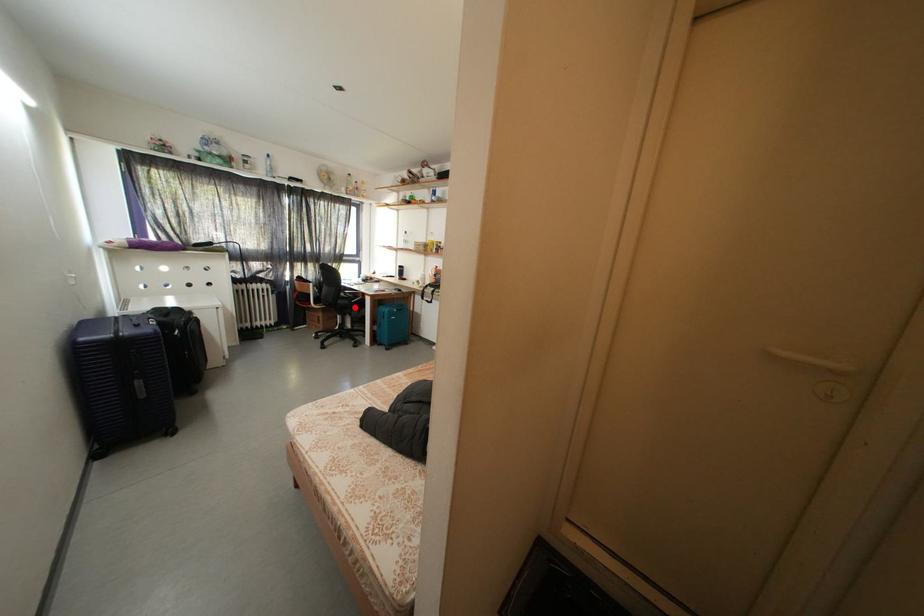
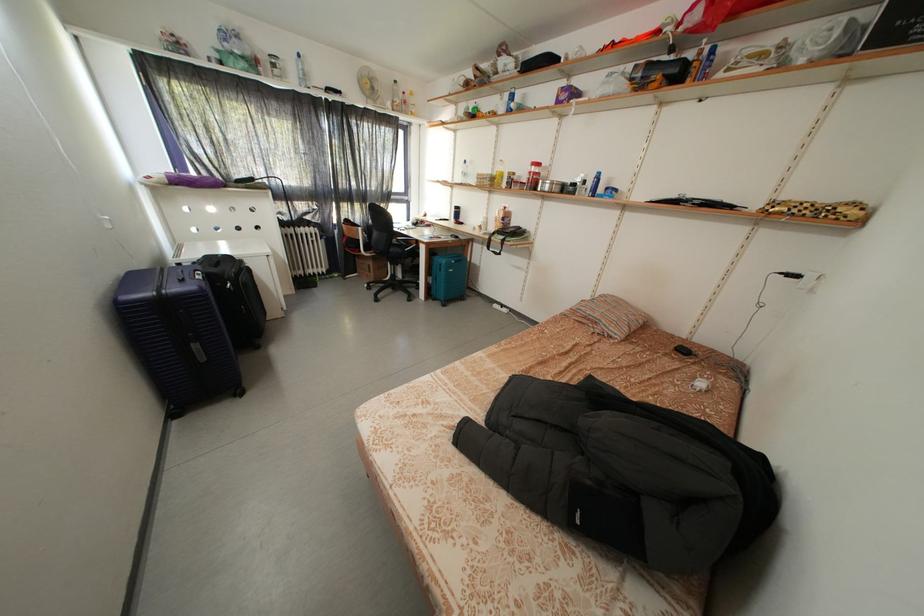
Question: I am providing you with two images of the same scene from different viewpoints. A red point is marked on the first image. At the location where the point appears in image 1, is it still visible in image 2?

Choices:
 (A) Yes
 (B) No

Answer: (A)